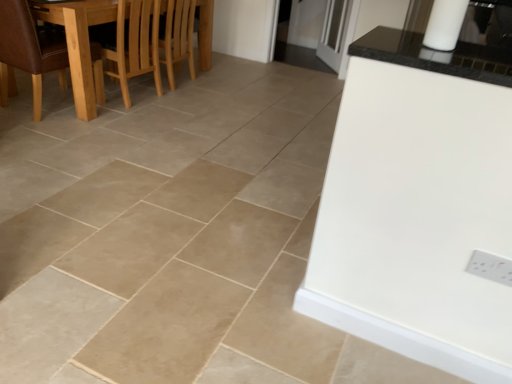
Question: From the image's perspective, is light brown wooden chair at upper left located above or below transparent glass door at upper center?

Choices:
 (A) below
 (B) above

Answer: (A)

Question: Would you say light brown wooden chair at upper left is to the left or to the right of transparent glass door at upper center in the picture?

Choices:
 (A) right
 (B) left

Answer: (B)

Question: Considering the real-world distances, which object is farthest from the white plastic electric outlet at lower right?

Choices:
 (A) wooden dining table at left
 (B) light brown wooden chair at upper left
 (C) transparent glass door at upper center
 (D) brown leather chair at left

Answer: (C)

Question: Considering the real-world distances, which object is closest to the brown leather chair at left?

Choices:
 (A) white plastic electric outlet at lower right
 (B) wooden dining table at left
 (C) transparent glass door at upper center
 (D) light brown wooden chair at upper left

Answer: (B)